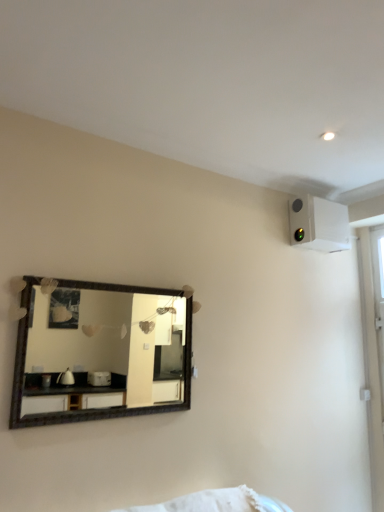
Describe the element at coordinates (98, 353) in the screenshot. Image resolution: width=384 pixels, height=512 pixels. I see `wooden-framed mirror at upper left` at that location.

What is the approximate width of wooden-framed mirror at upper left?

It is 5.20 centimeters.

What is the approximate height of wooden-framed mirror at upper left?

wooden-framed mirror at upper left is 27.75 inches tall.

What are the coordinates of `wooden-framed mirror at upper left` in the screenshot? It's located at (98, 353).

Locate an element on the screen. white plastic air conditioning unit at upper right is located at coordinates (318, 224).

What do you see at coordinates (318, 224) in the screenshot?
I see `white plastic air conditioning unit at upper right` at bounding box center [318, 224].

What are the coordinates of `wooden-framed mirror at upper left` in the screenshot? It's located at (98, 353).

Can you confirm if wooden-framed mirror at upper left is positioned to the right of white plastic air conditioning unit at upper right?

No, wooden-framed mirror at upper left is not to the right of white plastic air conditioning unit at upper right.

Is wooden-framed mirror at upper left in front of or behind white plastic air conditioning unit at upper right in the image?

In the image, wooden-framed mirror at upper left appears in front of white plastic air conditioning unit at upper right.

Is point (109, 347) behind point (322, 217)?

No.

From the image's perspective, is wooden-framed mirror at upper left over white plastic air conditioning unit at upper right?

Incorrect, from the image's perspective, wooden-framed mirror at upper left is lower than white plastic air conditioning unit at upper right.

From a real-world perspective, is wooden-framed mirror at upper left above or below white plastic air conditioning unit at upper right?

wooden-framed mirror at upper left is situated lower than white plastic air conditioning unit at upper right in the real world.

Can you confirm if wooden-framed mirror at upper left is thinner than white plastic air conditioning unit at upper right?

Yes.

Considering the relative sizes of wooden-framed mirror at upper left and white plastic air conditioning unit at upper right in the image provided, is wooden-framed mirror at upper left shorter than white plastic air conditioning unit at upper right?

In fact, wooden-framed mirror at upper left may be taller than white plastic air conditioning unit at upper right.

Based on their sizes in the image, would you say wooden-framed mirror at upper left is bigger or smaller than white plastic air conditioning unit at upper right?

In the image, wooden-framed mirror at upper left appears to be smaller than white plastic air conditioning unit at upper right.

Is wooden-framed mirror at upper left completely or partially outside of white plastic air conditioning unit at upper right?

Yes, wooden-framed mirror at upper left is located beyond the bounds of white plastic air conditioning unit at upper right.

Does wooden-framed mirror at upper left touch white plastic air conditioning unit at upper right?

No, wooden-framed mirror at upper left is not beside white plastic air conditioning unit at upper right.

Does wooden-framed mirror at upper left turn towards white plastic air conditioning unit at upper right?

No, wooden-framed mirror at upper left does not turn towards white plastic air conditioning unit at upper right.

Find the location of a particular element. Image resolution: width=384 pixels, height=512 pixels. air conditioning behind the wooden-framed mirror at upper left is located at coordinates (318, 224).

Considering the relative positions of white plastic air conditioning unit at upper right and wooden-framed mirror at upper left in the image provided, is white plastic air conditioning unit at upper right to the right of wooden-framed mirror at upper left from the viewer's perspective?

Indeed, white plastic air conditioning unit at upper right is positioned on the right side of wooden-framed mirror at upper left.

Between white plastic air conditioning unit at upper right and wooden-framed mirror at upper left, which one is positioned in front?

wooden-framed mirror at upper left is more forward.

Does point (322, 241) lie behind point (136, 303)?

Yes, it is.

From the image's perspective, between white plastic air conditioning unit at upper right and wooden-framed mirror at upper left, who is located below?

wooden-framed mirror at upper left appears lower in the image.

From a real-world perspective, which object stands above the other?

white plastic air conditioning unit at upper right, from a real-world perspective.

Considering the sizes of objects white plastic air conditioning unit at upper right and wooden-framed mirror at upper left in the image provided, who is thinner, white plastic air conditioning unit at upper right or wooden-framed mirror at upper left?

With smaller width is wooden-framed mirror at upper left.

Can you confirm if white plastic air conditioning unit at upper right is taller than wooden-framed mirror at upper left?

Incorrect, the height of white plastic air conditioning unit at upper right is not larger of that of wooden-framed mirror at upper left.

In terms of size, does white plastic air conditioning unit at upper right appear bigger or smaller than wooden-framed mirror at upper left?

Clearly, white plastic air conditioning unit at upper right is larger in size than wooden-framed mirror at upper left.

Would you say white plastic air conditioning unit at upper right contains wooden-framed mirror at upper left?

No, wooden-framed mirror at upper left is not a part of white plastic air conditioning unit at upper right.

Is white plastic air conditioning unit at upper right with wooden-framed mirror at upper left?

They are not placed beside each other.

Is white plastic air conditioning unit at upper right oriented towards wooden-framed mirror at upper left?

No.

Where is `air conditioning on the right of wooden-framed mirror at upper left`? Image resolution: width=384 pixels, height=512 pixels. air conditioning on the right of wooden-framed mirror at upper left is located at coordinates (318, 224).

You are a GUI agent. You are given a task and a screenshot of the screen. Output one action in this format:
    pyautogui.click(x=<x>, y=<y>)
    Task: Click on the mirror beneath the white plastic air conditioning unit at upper right (from a real-world perspective)
    Image resolution: width=384 pixels, height=512 pixels.
    Given the screenshot: What is the action you would take?
    pyautogui.click(x=98, y=353)

You are a GUI agent. You are given a task and a screenshot of the screen. Output one action in this format:
    pyautogui.click(x=<x>, y=<y>)
    Task: Click on the air conditioning above the wooden-framed mirror at upper left (from the image's perspective)
    
    Given the screenshot: What is the action you would take?
    pos(318,224)